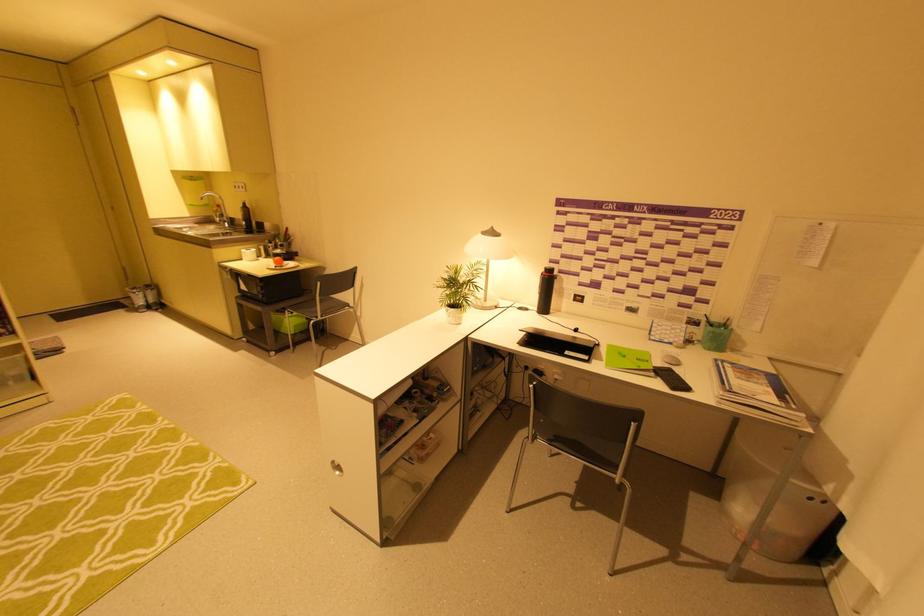
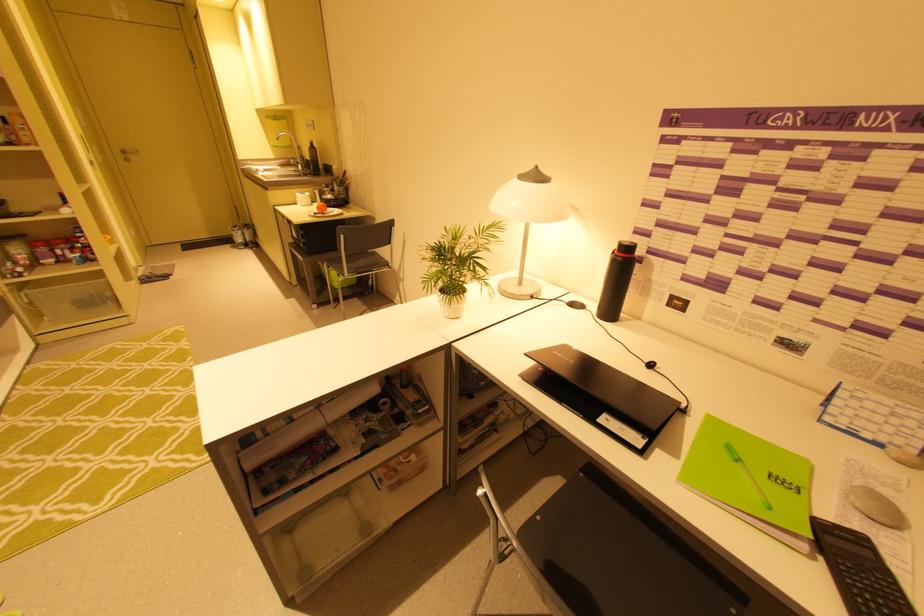
Where in the second image is the point corresponding to (246,206) from the first image?

(313, 146)